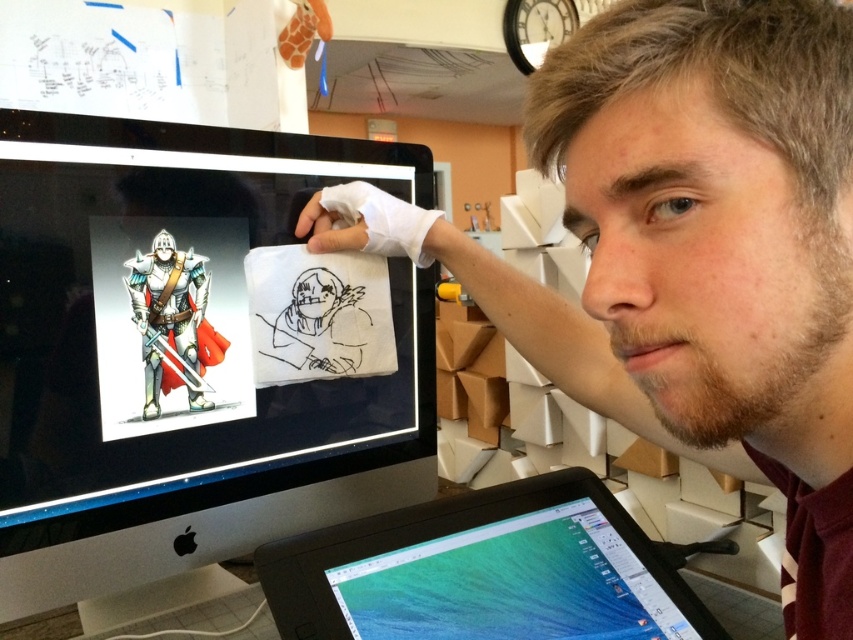
You are an artist trying to decide where to place your new digital drawing tool. You have two options on the desk shown in the image. The black glossy monitor at upper left and the black plastic tablet at lower center. Which object has a smaller width?

The black glossy monitor at upper left has a lesser width compared to the black plastic tablet at lower center, so the black glossy monitor at upper left is smaller in width.

You are a person with a 24 inch ruler. You want to measure the distance between yourself and the black glossy monitor at upper left. Can your ruler reach the monitor?

The distance between you and the black glossy monitor at upper left is 25.23 inches. Since your ruler is only 24 inches long, it cannot fully measure the distance. You will need a longer ruler or measuring tool.

You have a 10 inch long ruler that you want to place between the black glossy monitor at upper left and the black plastic tablet at lower center. Can the ruler fit entirely between them without overlapping either device?

The distance between the black glossy monitor at upper left and the black plastic tablet at lower center is 10.08 inches. Since the ruler is 10 inches long, it can fit entirely between them with a small gap of 0.08 inches remaining.